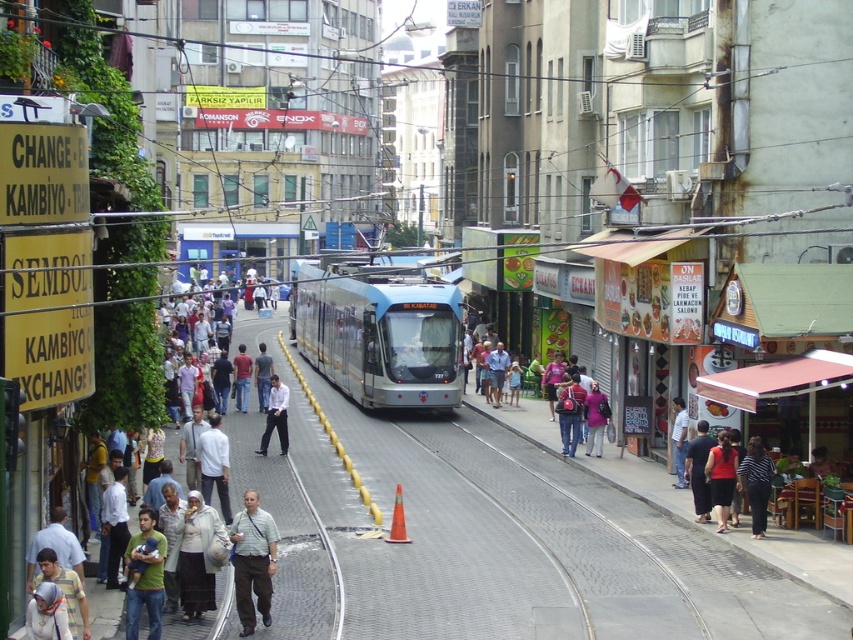
Question: From the image, what is the correct spatial relationship of light brown leather jacket at center in relation to green cotton shirt at center?

Choices:
 (A) above
 (B) below

Answer: (A)

Question: Which of these objects is positioned closest to the striped fabric shirt at center?

Choices:
 (A) matte red shirt at center
 (B) white shirt at center
 (C) light gray shirt at center
 (D) green cotton shirt at center

Answer: (A)

Question: Which object is farther from the camera taking this photo?

Choices:
 (A) light brown leather jacket at center
 (B) light gray shirt at center

Answer: (B)

Question: Is light gray shirt at center wider than light brown leather jacket at center?

Choices:
 (A) no
 (B) yes

Answer: (A)

Question: Is striped fabric shirt at center bigger than matte red shirt at center?

Choices:
 (A) yes
 (B) no

Answer: (B)

Question: Which of the following is the farthest from the observer?

Choices:
 (A) matte red shirt at center
 (B) light brown leather jacket at center
 (C) light gray shirt at center

Answer: (A)